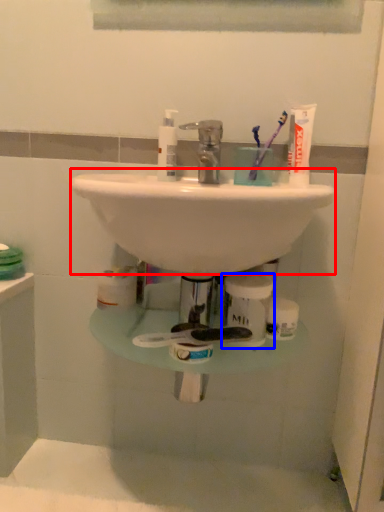
Question: Which of the following is the farthest to the observer, sink (highlighted by a red box) or toiletry (highlighted by a blue box)?

Choices:
 (A) sink
 (B) toiletry

Answer: (B)